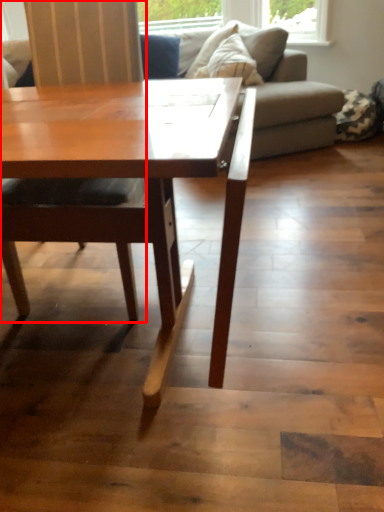
Question: From the image, what is the correct spatial relationship of chair (annotated by the red box) in relation to studio couch?

Choices:
 (A) left
 (B) right

Answer: (A)